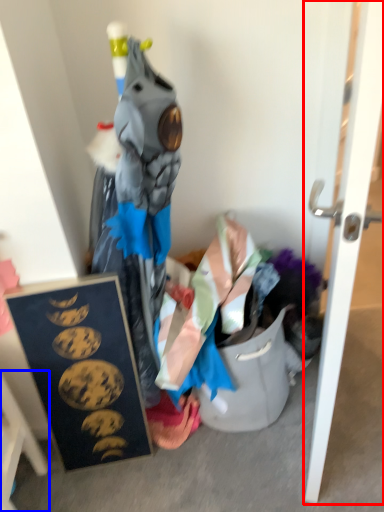
Question: Which object appears farthest to the camera in this image, door (highlighted by a red box) or furniture (highlighted by a blue box)?

Choices:
 (A) door
 (B) furniture

Answer: (B)